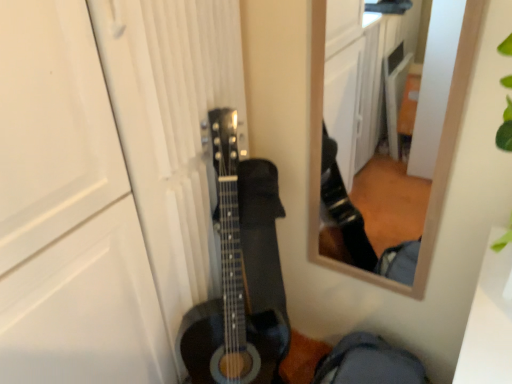
This screenshot has height=384, width=512. What do you see at coordinates (240, 274) in the screenshot? I see `black matte acoustic guitar at center` at bounding box center [240, 274].

Identify the location of black matte acoustic guitar at center. (240, 274).

The image size is (512, 384). Identify the location of black matte acoustic guitar at center. (240, 274).